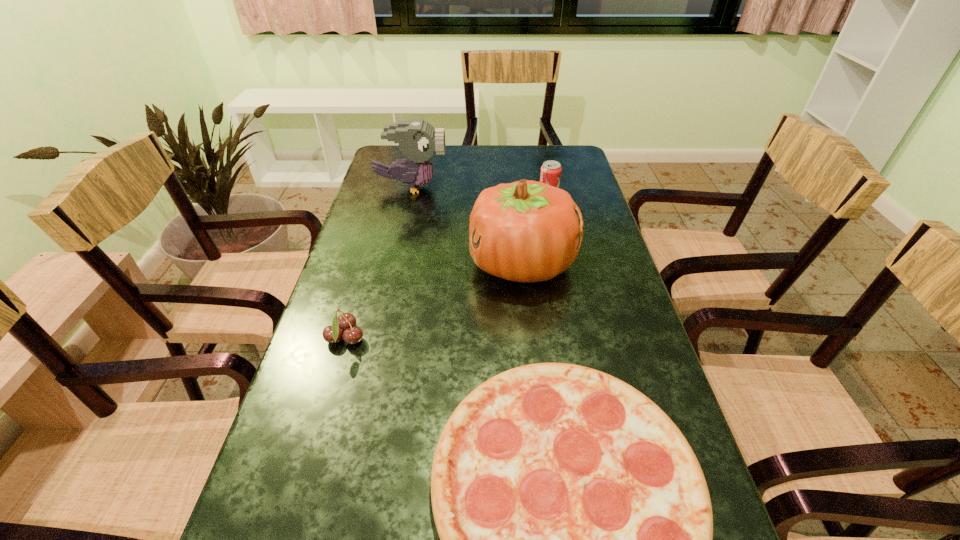
Identify the location of pumpkin. (527, 231).

Where is `bird`? This screenshot has width=960, height=540. bird is located at coordinates (417, 139).

What are the coordinates of `the third shortest object` in the screenshot? It's located at (550, 174).

Where is `the second nearest object`? the second nearest object is located at coordinates (345, 321).

Identify the location of cherry. (345, 321).

I want to click on free space located 0.180m on the side of the third nearest object with the cute face, so click(x=402, y=263).

Where is `blank area located on the side of the third nearest object with the cute face`? This screenshot has height=540, width=960. blank area located on the side of the third nearest object with the cute face is located at coordinates (444, 263).

The width and height of the screenshot is (960, 540). Find the location of `vacant area situated 0.160m on the side of the third nearest object with the cute face`. vacant area situated 0.160m on the side of the third nearest object with the cute face is located at coordinates (410, 263).

Find the location of `free region located at the beak of the bird`. free region located at the beak of the bird is located at coordinates (558, 187).

Find the location of a particular element. Image resolution: width=960 pixels, height=540 pixels. free space located 0.060m on the back of the third tallest object is located at coordinates (545, 180).